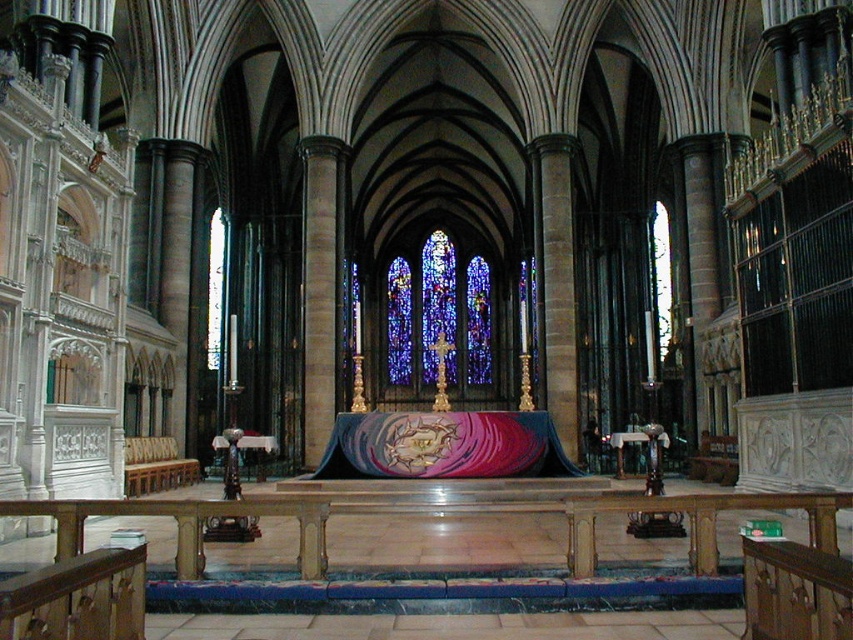
Is point (430, 273) positioned behind point (126, 477)?

That is True.

In the scene shown: Can you confirm if stained glass at center is positioned to the left of wooden polished bench at lower left?

In fact, stained glass at center is to the right of wooden polished bench at lower left.

The width and height of the screenshot is (853, 640). Describe the element at coordinates (439, 316) in the screenshot. I see `stained glass at center` at that location.

Find the location of a particular element. The width and height of the screenshot is (853, 640). stained glass at center is located at coordinates (439, 316).